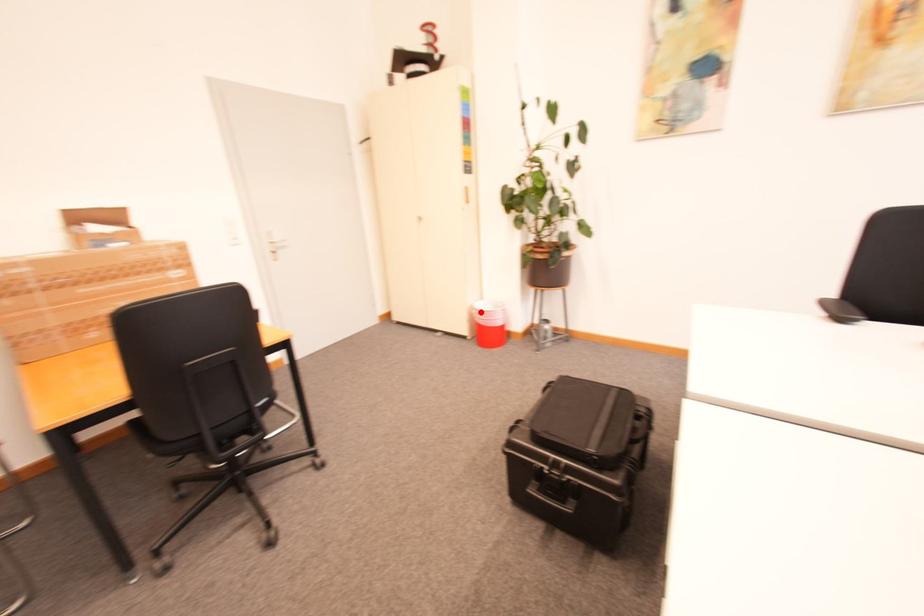
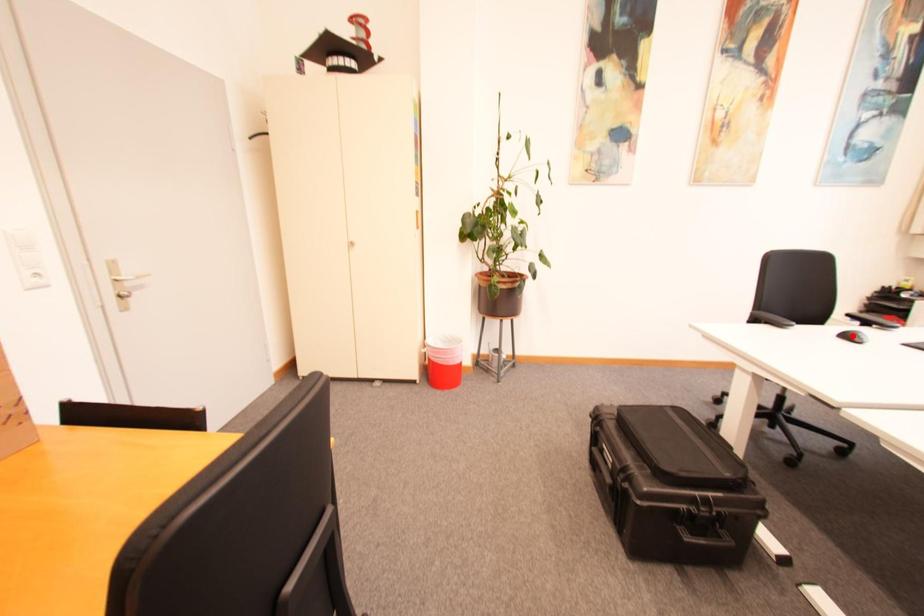
I am providing you with two images of the same scene from different viewpoints. A red point is marked on the first image and another point is marked on the second image. Do the highlighted points in image1 and image2 indicate the same real-world spot?

No